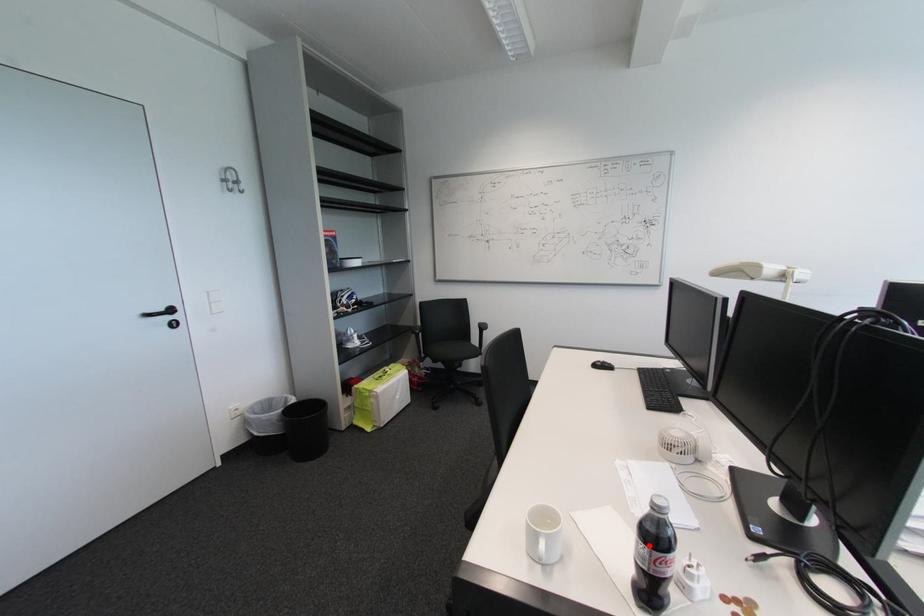
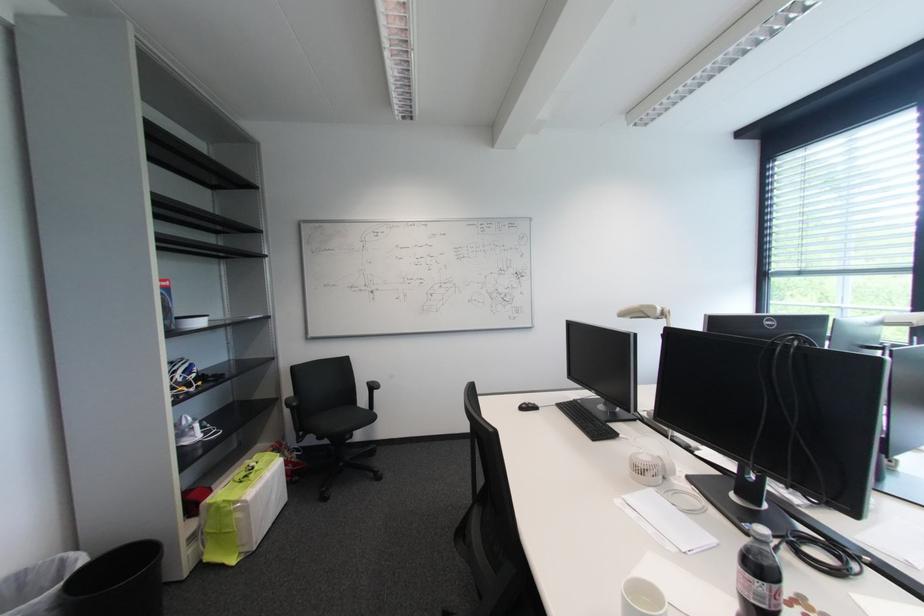
Find the pixel in the second image that matches the highlighted location in the first image.

(766, 583)